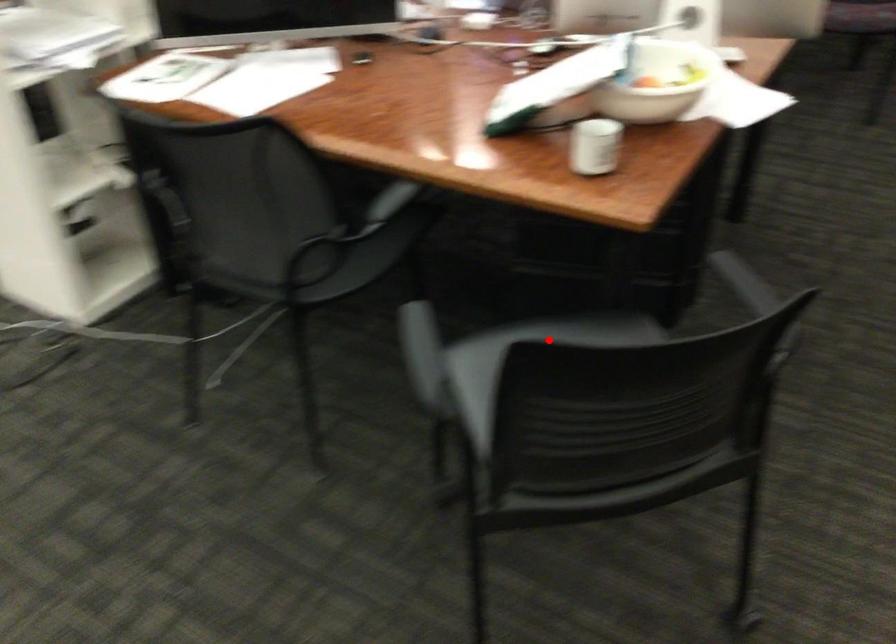
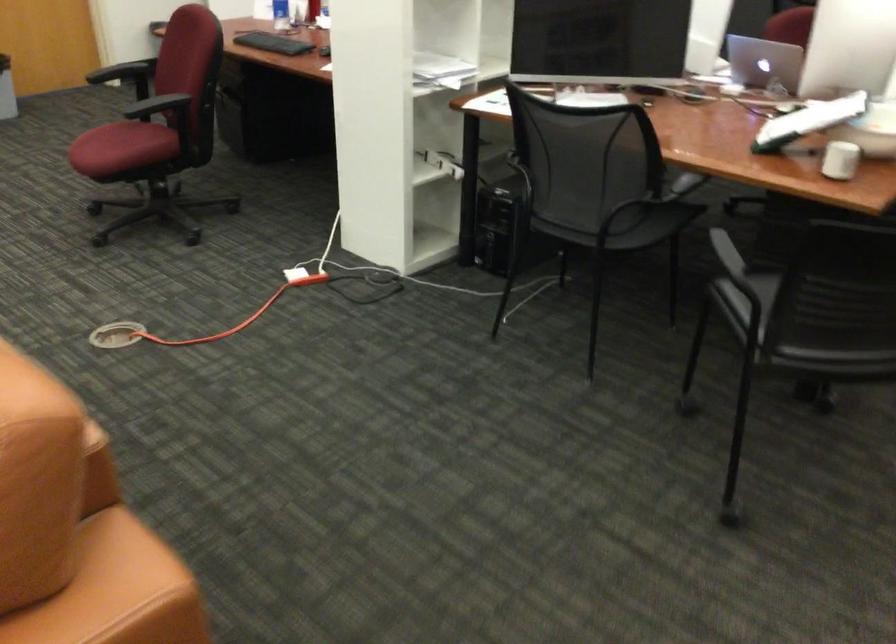
Question: I am providing you with two images of the same scene from different viewpoints. A red point is marked on the first image. At the location where the point appears in image 1, is it still visible in image 2?

Choices:
 (A) Yes
 (B) No

Answer: (B)